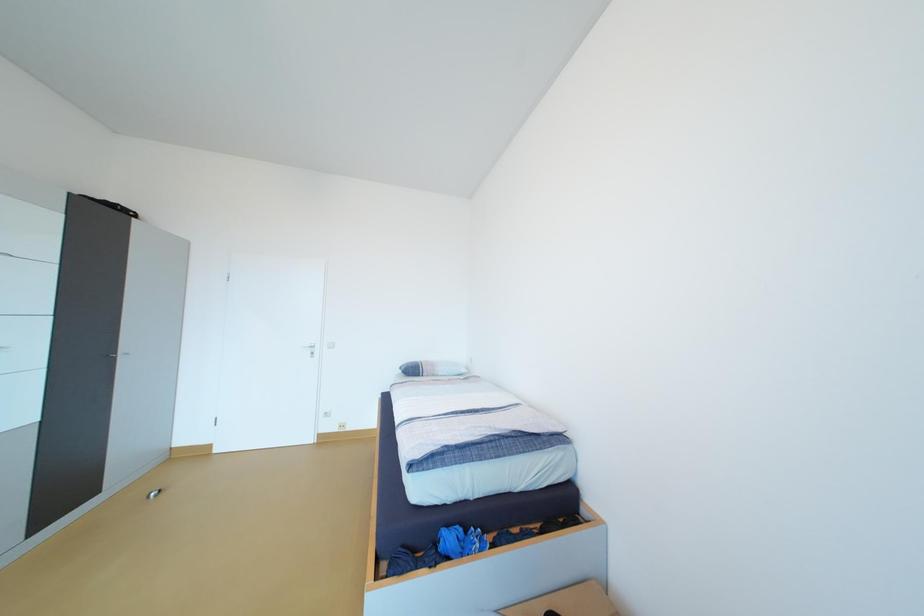
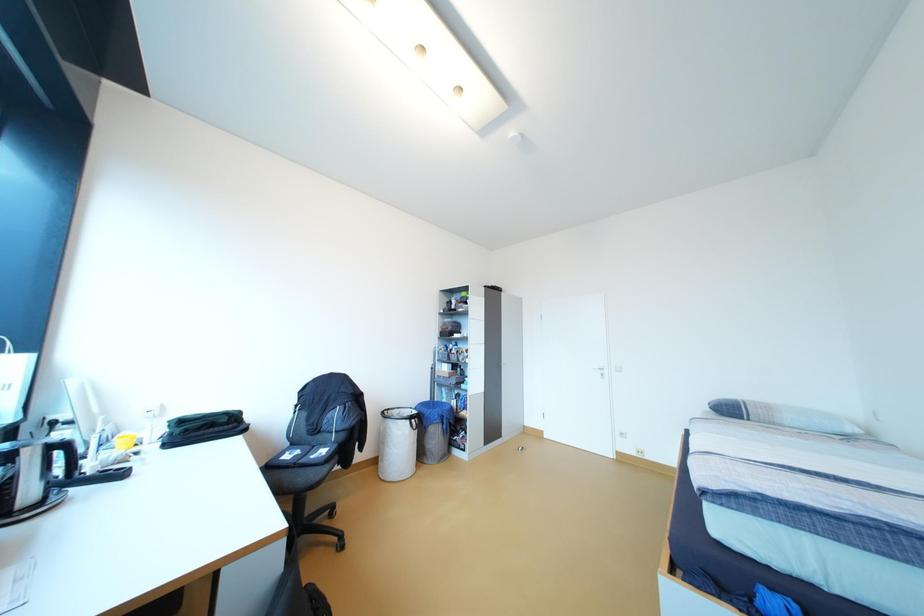
Question: How did the camera likely rotate?

Choices:
 (A) Left
 (B) Right
 (C) Up
 (D) Down

Answer: (A)